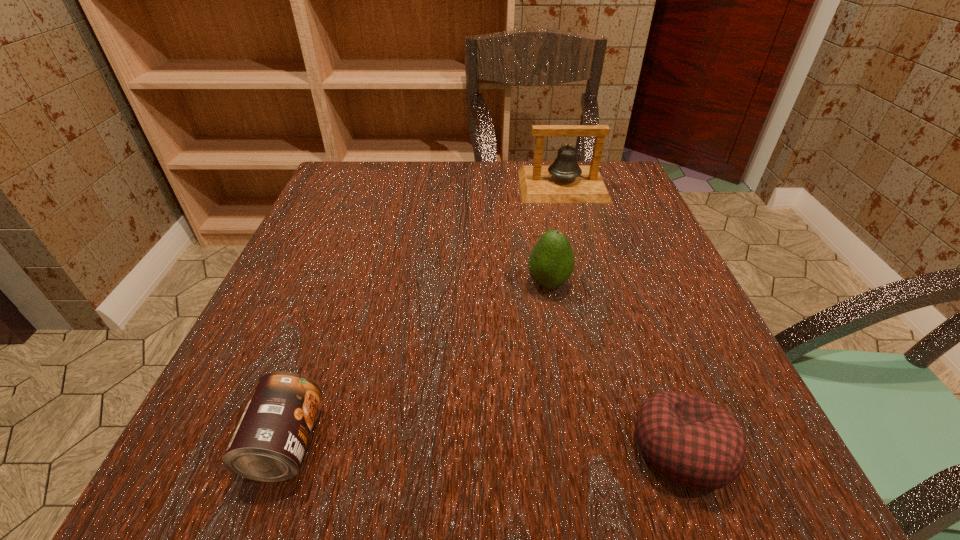
This screenshot has height=540, width=960. I want to click on free area in between the beanbag and the third shortest object, so click(x=615, y=366).

Where is `vacant area that lies between the avocado and the leftmost object`? The image size is (960, 540). vacant area that lies between the avocado and the leftmost object is located at coordinates (417, 363).

Find the location of `free space between the beanbag and the bell`. free space between the beanbag and the bell is located at coordinates (622, 317).

Find the location of `the second closest object to the can`. the second closest object to the can is located at coordinates (693, 442).

Locate which object is the third closest to the third shortest object. Please provide its 2D coordinates. Your answer should be formatted as a tuple, i.e. [(x, y)], where the tuple contains the x and y coordinates of a point satisfying the conditions above.

[(268, 445)]

Find the location of a particular element. Image resolution: width=960 pixels, height=540 pixels. free location that satisfies the following two spatial constraints: 1. on the front side of the bell; 2. on the right side of the beanbag is located at coordinates (636, 448).

This screenshot has width=960, height=540. Find the location of `free space that satisfies the following two spatial constraints: 1. on the back side of the farthest object; 2. on the left side of the third nearest object`. free space that satisfies the following two spatial constraints: 1. on the back side of the farthest object; 2. on the left side of the third nearest object is located at coordinates (531, 186).

Where is `vacant space that satisfies the following two spatial constraints: 1. on the front side of the third nearest object; 2. on the front label of the can`? vacant space that satisfies the following two spatial constraints: 1. on the front side of the third nearest object; 2. on the front label of the can is located at coordinates (576, 443).